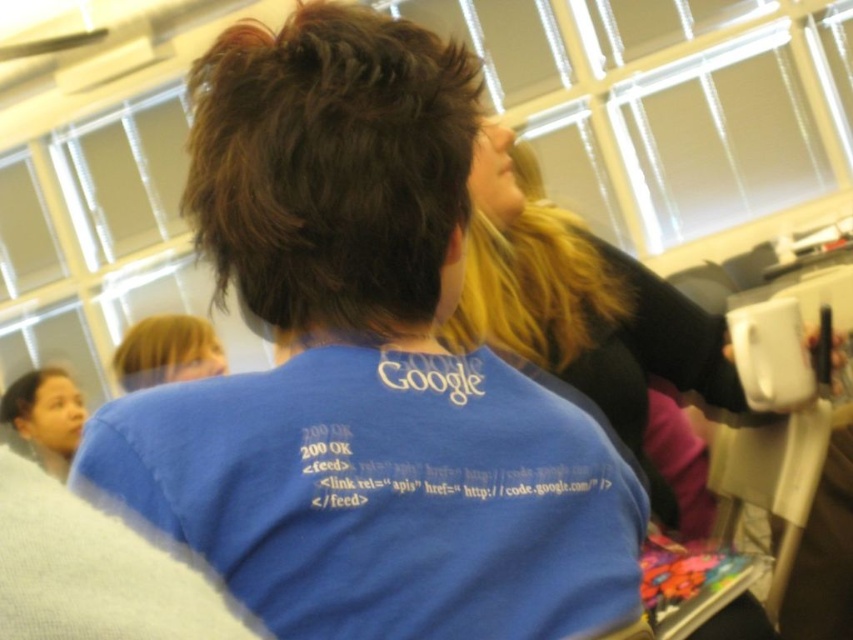
Question: Which of these objects is positioned farthest from the dark brown textured hair at center?

Choices:
 (A) brown matte hair at upper left
 (B) blue cotton t-shirt at center
 (C) blonde silky hair at upper center
 (D) blonde hair at upper left

Answer: (A)

Question: Which object appears farthest from the camera in this image?

Choices:
 (A) dark brown textured hair at center
 (B) brown matte hair at upper left

Answer: (B)

Question: Can you confirm if blue cotton t-shirt at center is positioned to the right of dark brown textured hair at center?

Choices:
 (A) yes
 (B) no

Answer: (A)

Question: Is dark brown textured hair at center in front of blonde hair at upper left?

Choices:
 (A) yes
 (B) no

Answer: (A)

Question: Is blue cotton t-shirt at center above blonde silky hair at upper center?

Choices:
 (A) yes
 (B) no

Answer: (B)

Question: Which object is positioned closest to the blonde hair at upper left?

Choices:
 (A) blue cotton t-shirt at center
 (B) brown matte hair at upper left
 (C) dark brown textured hair at center

Answer: (B)